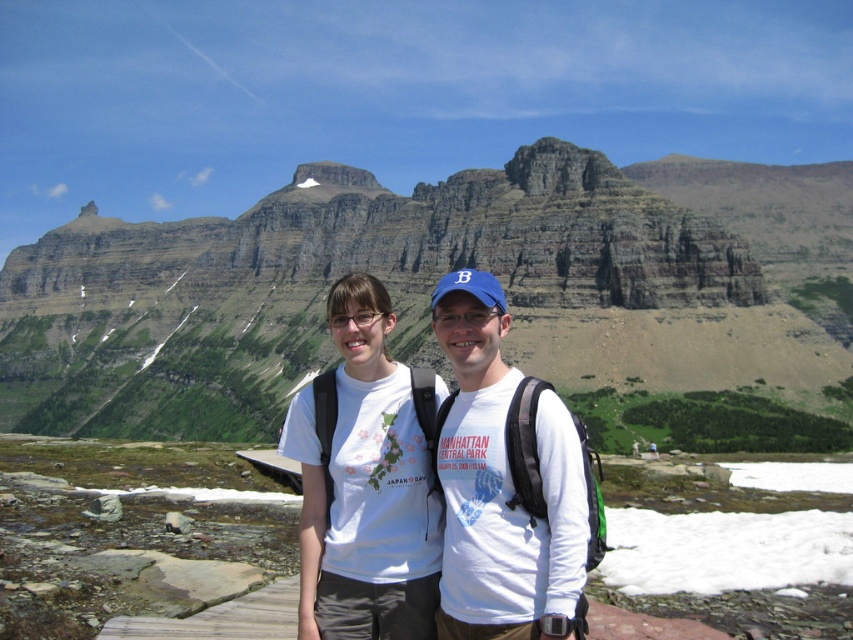
Question: Which of the following is the closest to the observer?

Choices:
 (A) rocky cliff at center
 (B) white cotton t-shirt at center

Answer: (B)

Question: Is rocky cliff at center in front of white cotton t-shirt at center?

Choices:
 (A) yes
 (B) no

Answer: (B)

Question: Is rocky cliff at center wider than white cotton t-shirt at center?

Choices:
 (A) no
 (B) yes

Answer: (B)

Question: Which point is closer to the camera taking this photo?

Choices:
 (A) (395, 509)
 (B) (776, 208)

Answer: (A)

Question: Is rocky cliff at center smaller than white cotton t-shirt at center?

Choices:
 (A) yes
 (B) no

Answer: (B)

Question: Among these objects, which one is nearest to the camera?

Choices:
 (A) rocky cliff at center
 (B) white cotton t-shirt at center

Answer: (B)